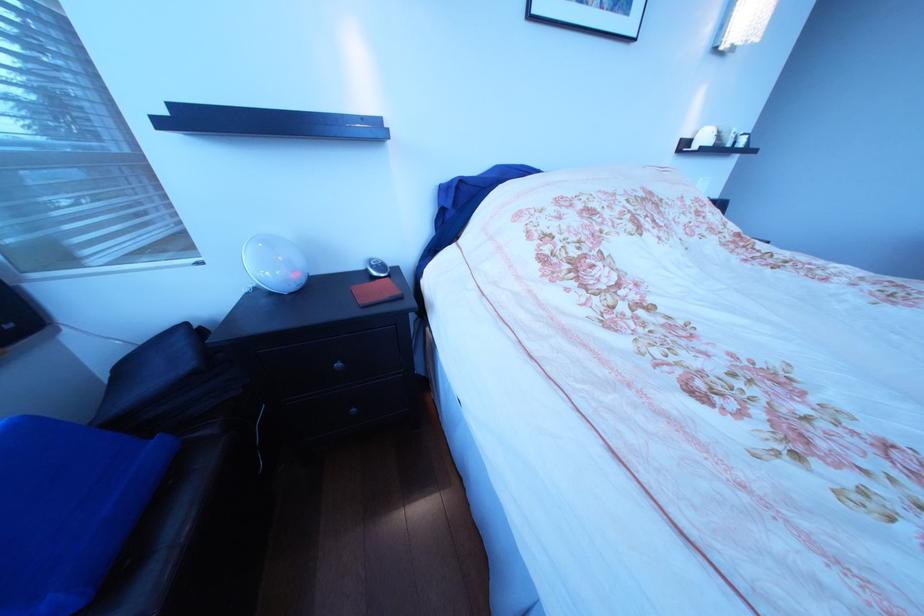
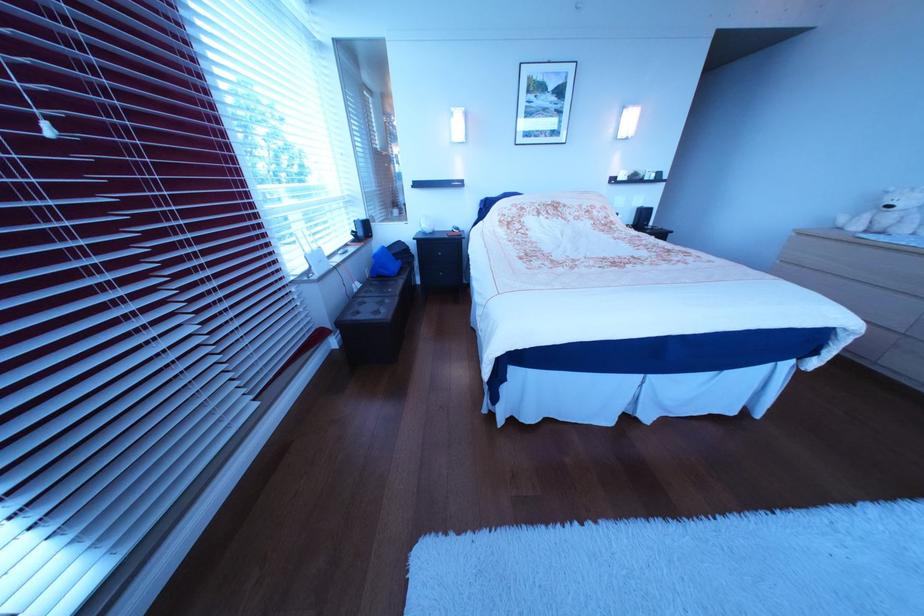
Question: I am providing you with two images of the same scene from different viewpoints. Please identify which objects are invisible in image2.

Choices:
 (A) red leather case
 (B) blue fabric bag
 (C) dresser drawer edge
 (D) brown folded blanket

Answer: (A)